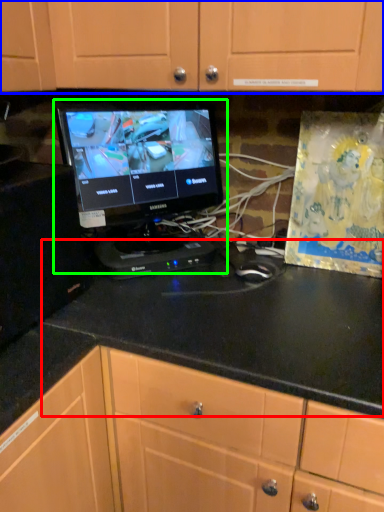
Question: Based on their relative distances, which object is nearer to counter top (highlighted by a red box)? Choose from cabinetry (highlighted by a blue box) and computer monitor (highlighted by a green box).

Choices:
 (A) cabinetry
 (B) computer monitor

Answer: (B)